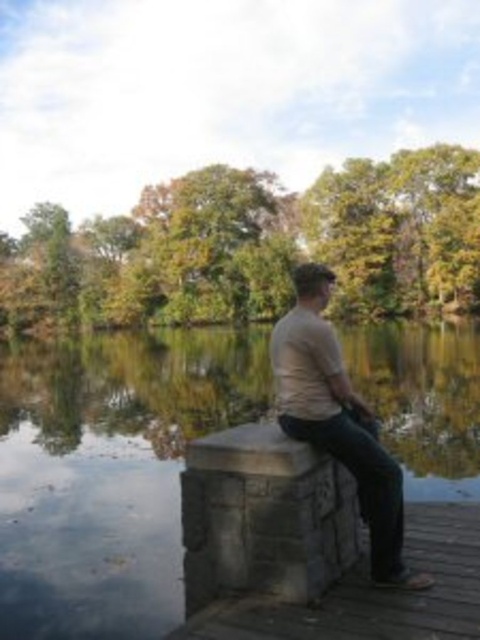
Question: Which object appears closest to the camera in this image?

Choices:
 (A) smooth stone lake at center
 (B) beige cotton shirt at center

Answer: (B)

Question: Can you confirm if smooth stone lake at center is wider than beige cotton shirt at center?

Choices:
 (A) no
 (B) yes

Answer: (B)

Question: Is smooth stone lake at center thinner than beige cotton shirt at center?

Choices:
 (A) no
 (B) yes

Answer: (A)

Question: Is smooth stone lake at center to the right of beige cotton shirt at center from the viewer's perspective?

Choices:
 (A) yes
 (B) no

Answer: (B)